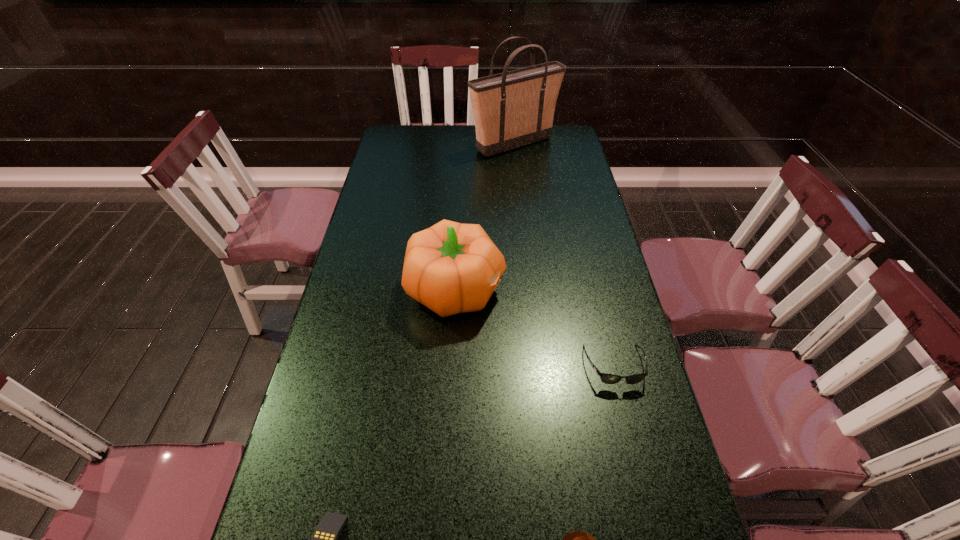
Locate an element on the screen. The height and width of the screenshot is (540, 960). object that stands as the second closest to the second farthest object is located at coordinates (325, 537).

Locate an element on the screen. The image size is (960, 540). the second closest object to the muffin is located at coordinates (325, 537).